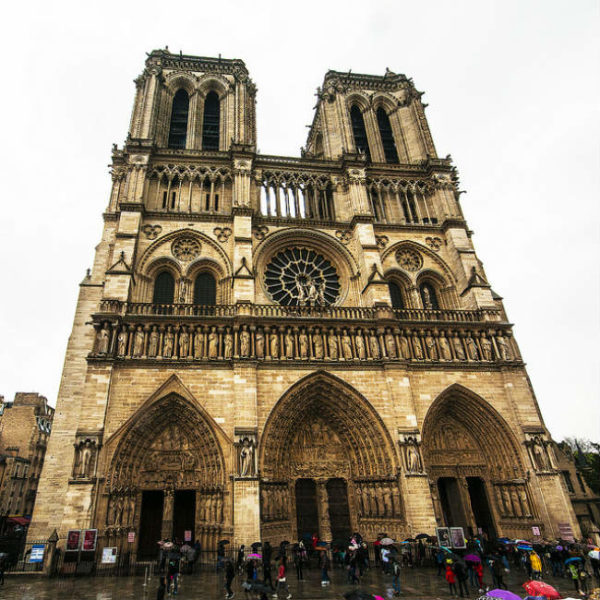
In order to click on light brown column in this screenshot , I will do `click(242, 250)`, `click(126, 242)`, `click(372, 257)`, `click(471, 257)`.